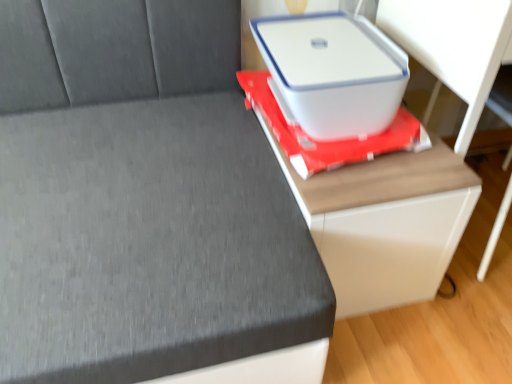
Question: From the image's perspective, is white plastic storage box at upper right above or below white glossy table at center?

Choices:
 (A) above
 (B) below

Answer: (A)

Question: Is point pyautogui.click(x=334, y=100) positioned closer to the camera than point pyautogui.click(x=410, y=201)?

Choices:
 (A) farther
 (B) closer

Answer: (A)

Question: Based on their relative distances, which object is nearer to the white plastic storage box at upper right?

Choices:
 (A) white matte computer desk at right
 (B) white plastic container at upper right
 (C) white glossy table at center

Answer: (C)

Question: Which object is the closest to the white matte computer desk at right?

Choices:
 (A) white plastic storage box at upper right
 (B) white plastic container at upper right
 (C) white glossy table at center

Answer: (A)